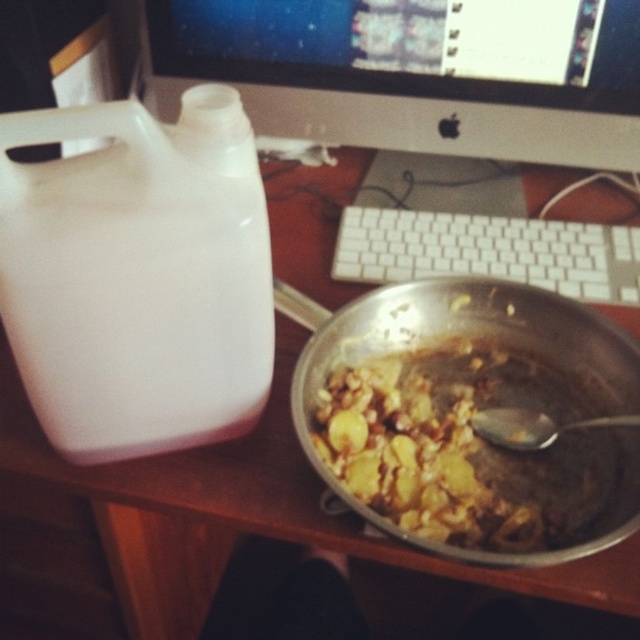
You are a robot trying to reach the spoon inside the stainless steel bowl in the center right of the desk. There are two points marked on the desk surface at coordinates point (449, 147) and point (502, 429). Which point is closer to you, the viewer?

Point (449, 147) is closer to the viewer than point (502, 429).

You are setting up a new monitor on your desk and want to place it at the same location as the white plastic monitor at upper center. According to the coordinates provided, where should you place the monitor?

The white plastic monitor at upper center should be placed at coordinates point (417, 72).

You are organizing the desk and need to place a new item between the white plastic monitor at upper center and the golden brown textured food at center. Considering their sizes, which object should you place closer to the edge of the desk to ensure enough space?

The golden brown textured food at center should be placed closer to the edge of the desk because the white plastic monitor at upper center is much taller, so it requires more space.